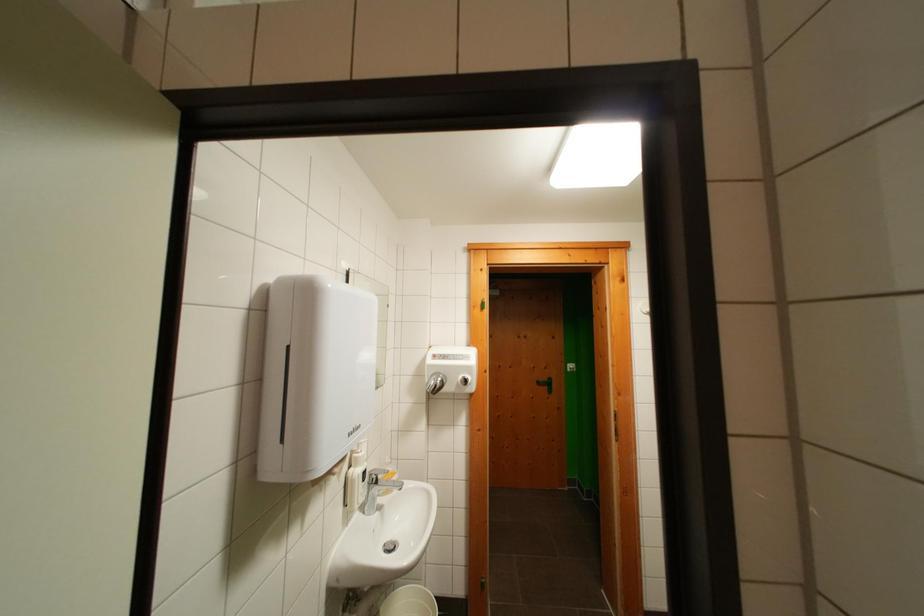
Which object does [408,602] point to?

It refers to a white bucket.